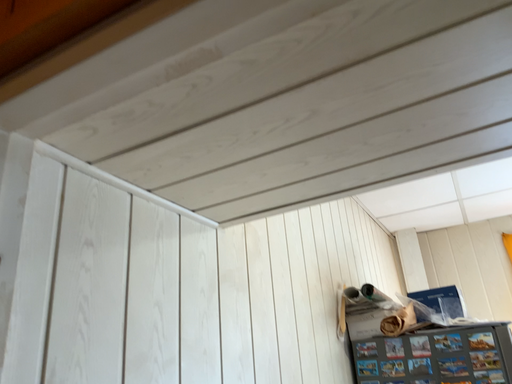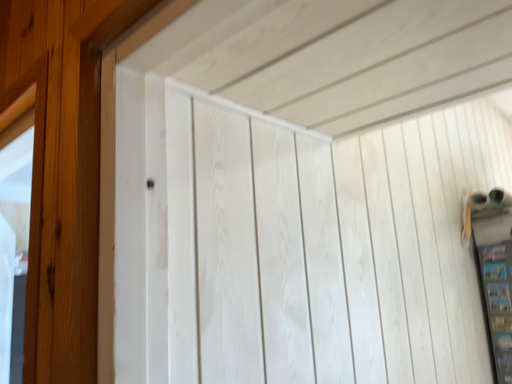
Question: Which way did the camera rotate in the video?

Choices:
 (A) rotated left
 (B) rotated right

Answer: (A)